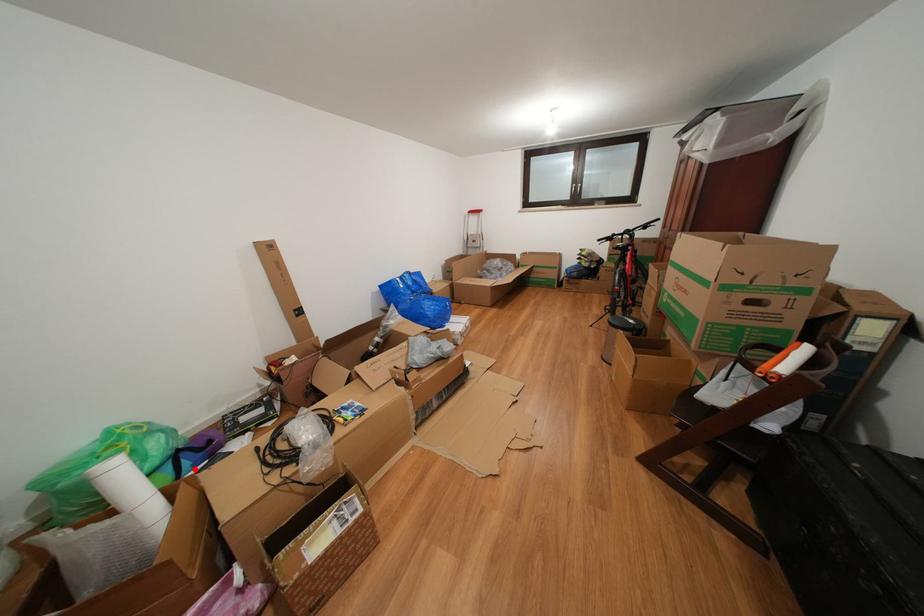
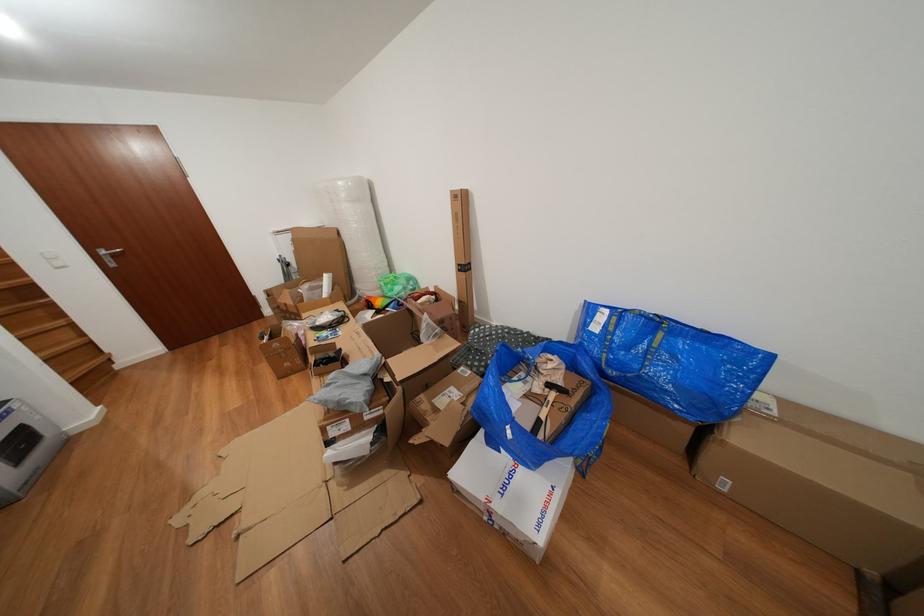
Question: I am providing you with two images of the same scene from different viewpoints. Given a red point in image1, look at the same physical point in image2. Is it:

Choices:
 (A) Closer to the viewpoint
 (B) Farther from the viewpoint

Answer: (B)